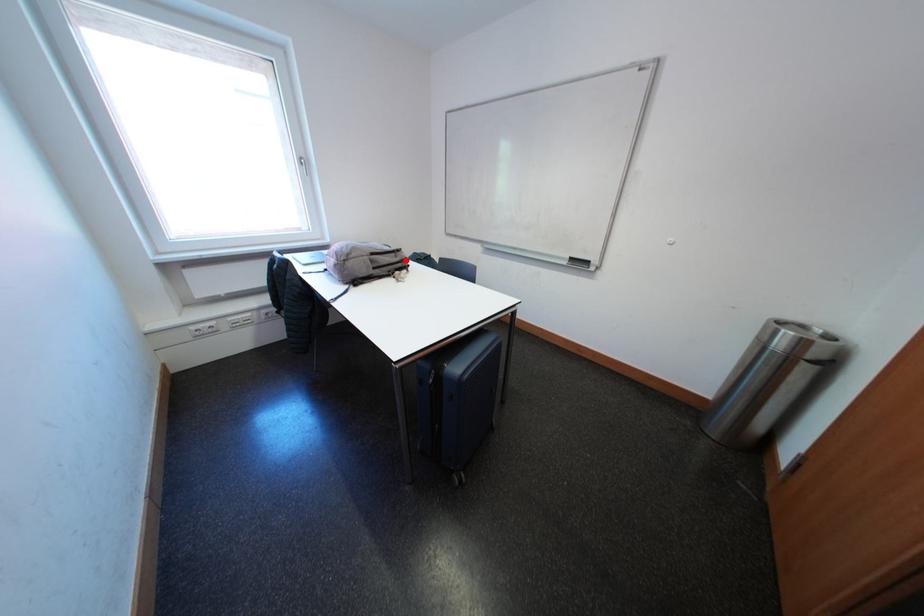
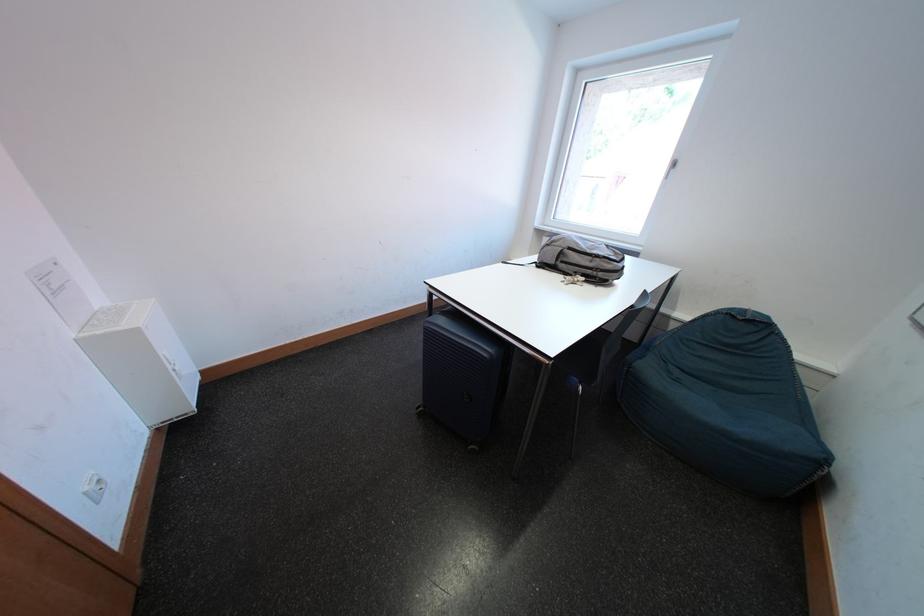
The point at the highlighted location is marked in the first image. Where is the corresponding point in the second image?

(601, 265)